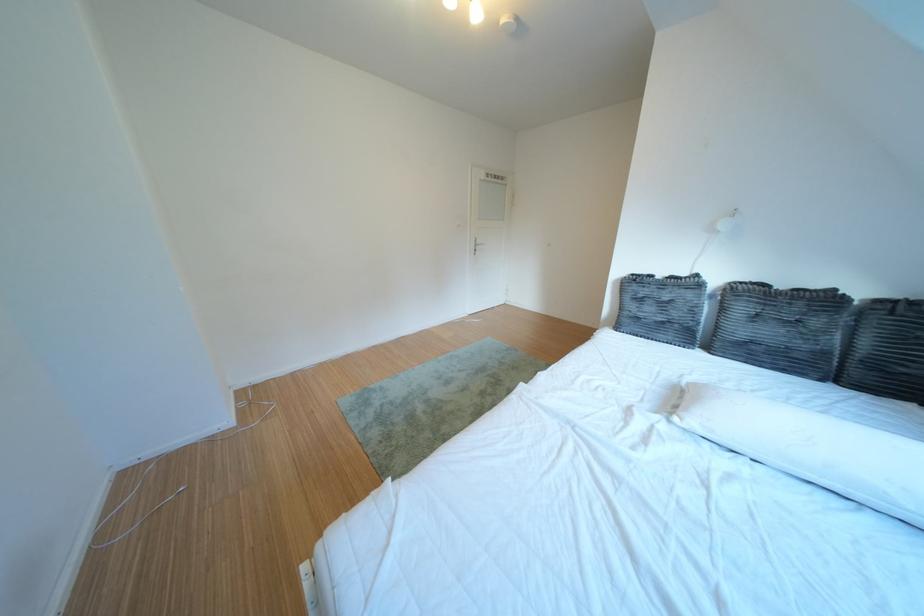
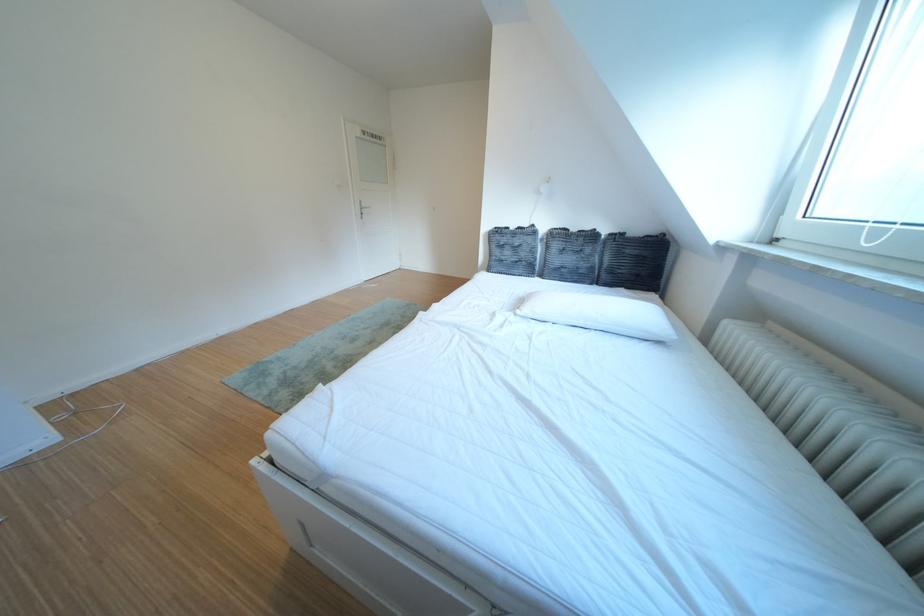
Question: The camera is either moving clockwise (left) or counter-clockwise (right) around the object. The first image is from the beginning of the video and the second image is from the end. Is the camera moving left or right when shooting the video?

Choices:
 (A) Left
 (B) Right

Answer: (A)